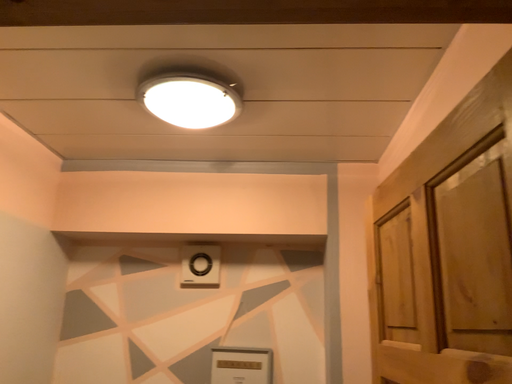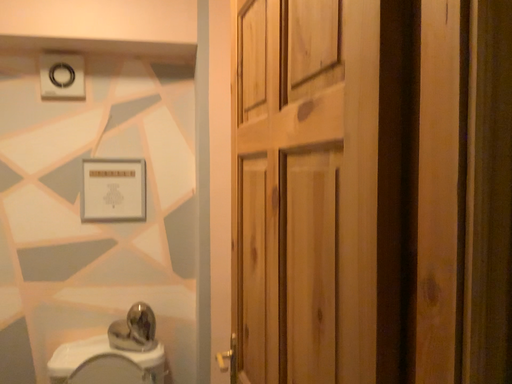
Question: Which way did the camera rotate in the video?

Choices:
 (A) rotated left
 (B) rotated right

Answer: (B)